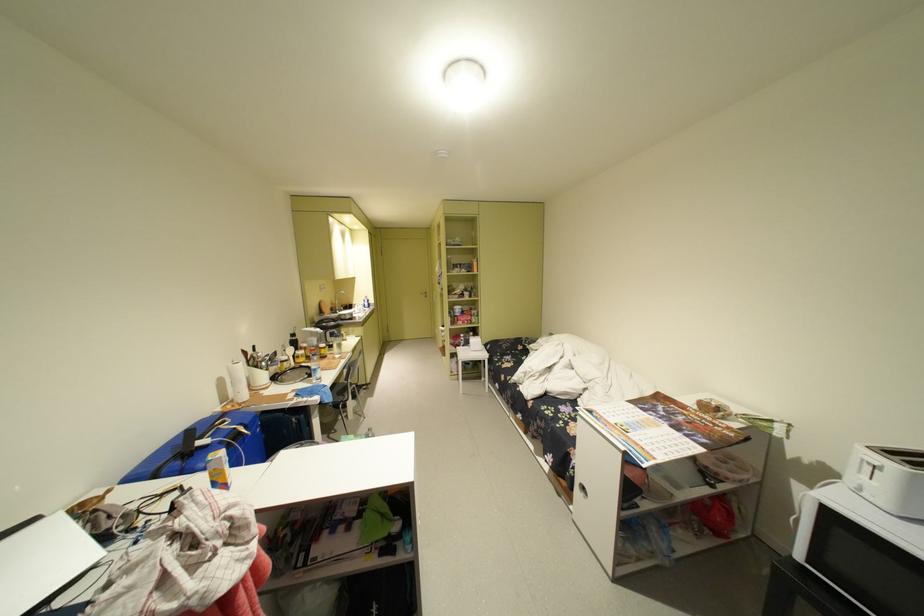
Find where to pull the silver door handle. Please return your answer as a coordinate pair (x, y).

(581, 490)